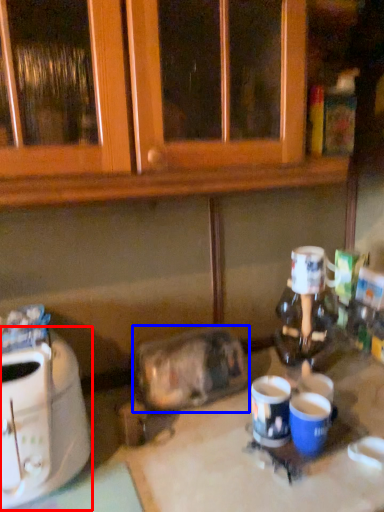
Question: Which object is closer to the camera taking this photo, toaster (highlighted by a red box) or appliance (highlighted by a blue box)?

Choices:
 (A) toaster
 (B) appliance

Answer: (A)